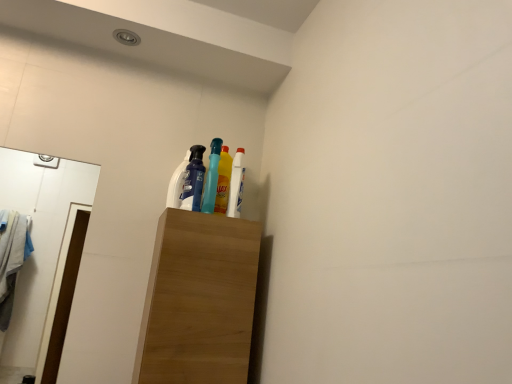
Question: In the image, is wooden cabinet at center positioned in front of or behind yellow glossy bottle at upper center, which is the first bottle in right-to-left order?

Choices:
 (A) behind
 (B) front

Answer: (B)

Question: Is wooden cabinet at center inside the boundaries of yellow glossy bottle at upper center, which is the first bottle in right-to-left order, or outside?

Choices:
 (A) inside
 (B) outside

Answer: (B)

Question: Which object is positioned closest to the yellow glossy bottle at upper center, positioned as the 2th bottle in left-to-right order?

Choices:
 (A) white glossy mirror at left
 (B) wooden cabinet at center
 (C) translucent blue bottle at center, which is counted as the second bottle, starting from the right
 (D) translucent blue bottle at center, the 2th cleaning product positioned from the back
 (E) matte white bottle at upper center, marked as the first cleaning product in a back-to-front arrangement

Answer: (C)

Question: Which of these objects is positioned closest to the matte white bottle at upper center, marked as the first cleaning product in a back-to-front arrangement?

Choices:
 (A) translucent blue bottle at center, placed as the first bottle when sorted from left to right
 (B) yellow glossy bottle at upper center, which is the first bottle in right-to-left order
 (C) wooden cabinet at center
 (D) white glossy mirror at left
 (E) translucent blue bottle at center, acting as the first cleaning product starting from the front

Answer: (E)